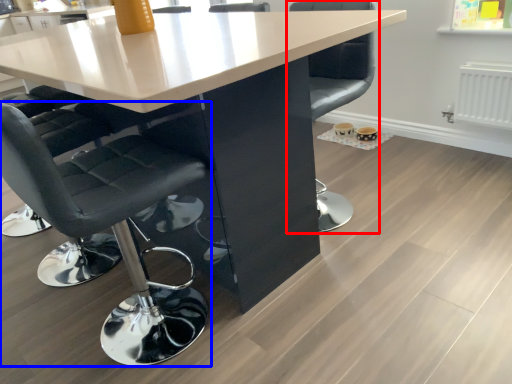
Question: Among these objects, which one is nearest to the camera, chair (highlighted by a red box) or chair (highlighted by a blue box)?

Choices:
 (A) chair
 (B) chair

Answer: (B)